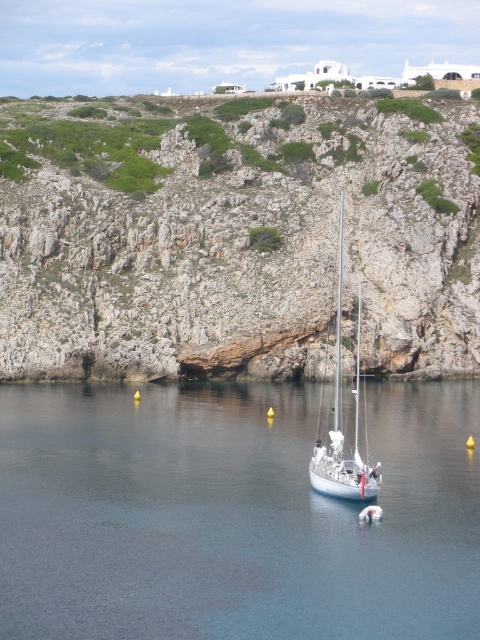
You are standing at the cliff edge looking out to the sea. There are two points marked on the cliff face. One is at coordinates point (56,317) and the other at point (332,442). Which point is closer to you?

Point (56,317) is closer to you because it is further to the viewer than point (332,442).

From the picture: You are planning to paint this coastal scene. You want to ensure the rocky cliff at center and the clear blue water at center are proportionally accurate. Which object should you make wider in your painting?

The rocky cliff at center should be made wider in the painting since its width surpasses that of the clear blue water at center according to the description.

You are a photographer planning to capture the entire scene of the clear blue water at center and the white glossy sailboat at center in one shot. Based on their sizes in the image, which object would you need to frame more carefully to ensure it doesn

The white glossy sailboat at center is smaller than the clear blue water at center, so you should frame the sailboat more carefully to ensure it is fully captured in the photo.